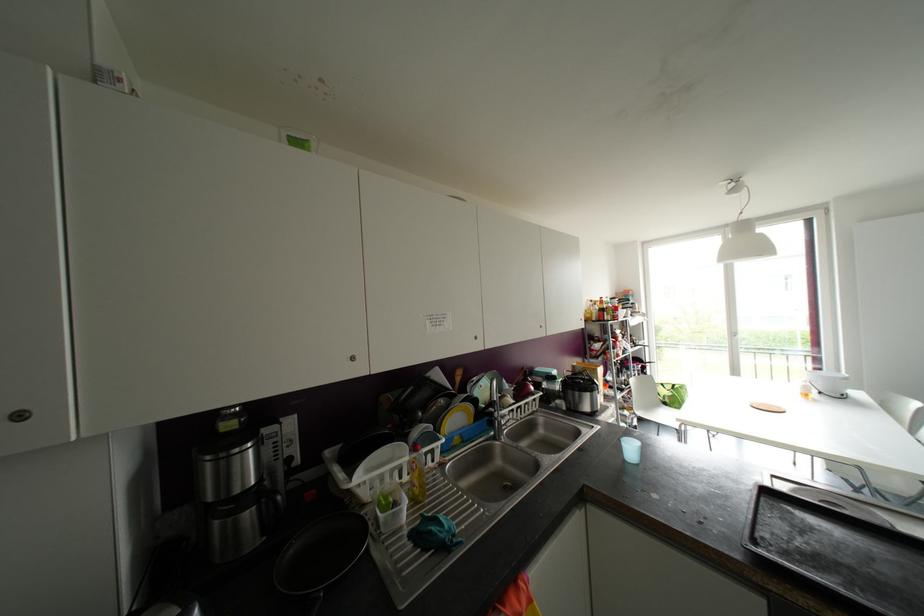
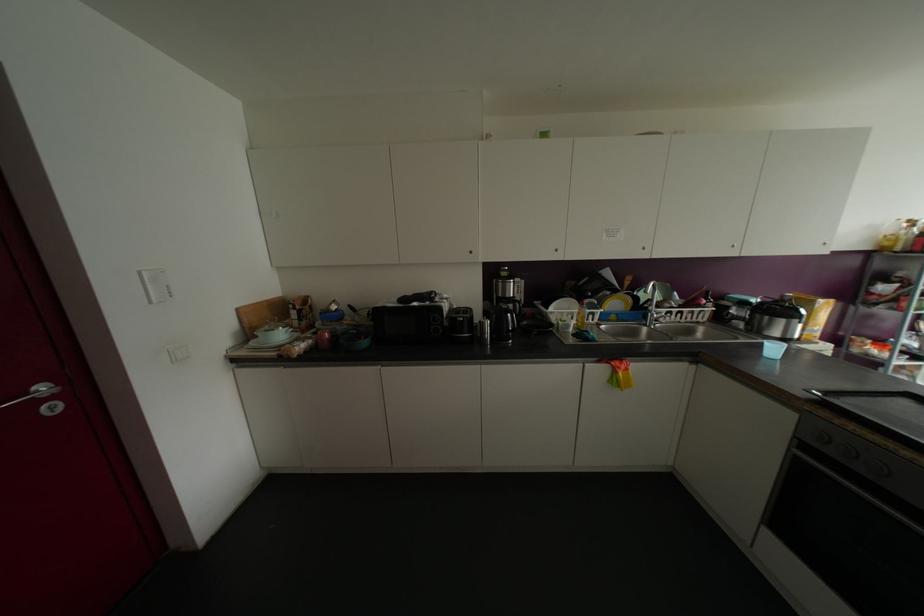
In the second image, find the point that corresponds to (x=248, y=515) in the first image.

(509, 306)